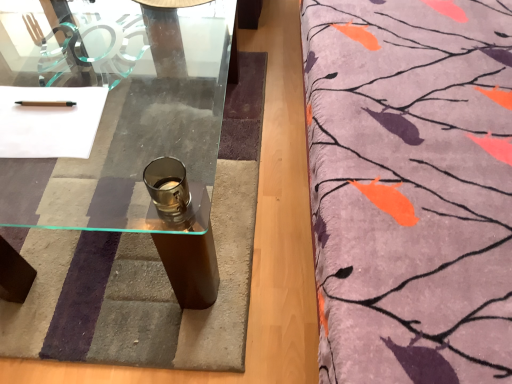
This screenshot has width=512, height=384. Describe the element at coordinates (126, 133) in the screenshot. I see `transparent glass table at center` at that location.

Measure the distance between transparent glass table at center and camera.

The depth of transparent glass table at center is 29.74 inches.

Identify the location of transparent glass table at center. (126, 133).

You are a GUI agent. You are given a task and a screenshot of the screen. Output one action in this format:
    pyautogui.click(x=<x>, y=<y>)
    Task: Click on the transparent glass table at center
    
    Given the screenshot: What is the action you would take?
    pyautogui.click(x=126, y=133)